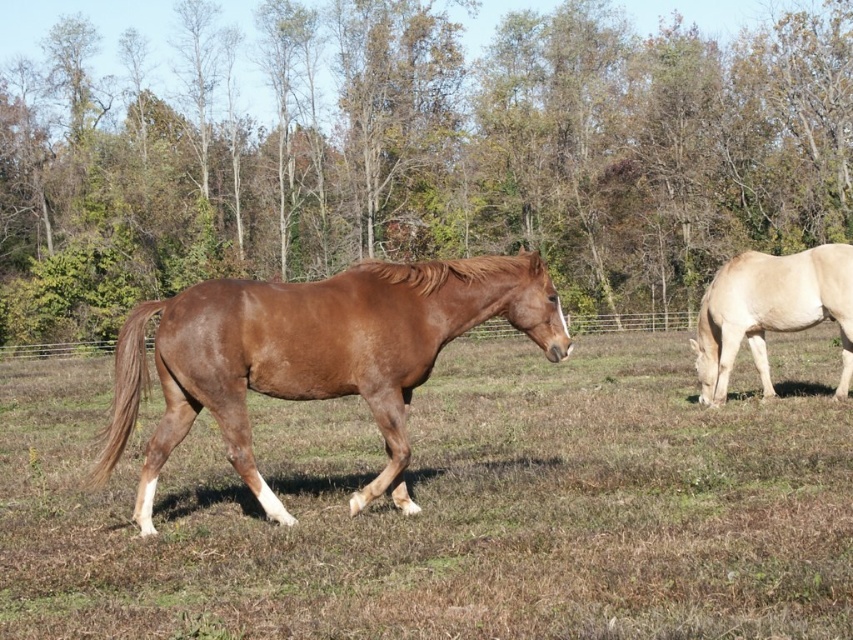
Question: Can you confirm if brown glossy horse at center is positioned to the right of light beige smooth horse at right?

Choices:
 (A) no
 (B) yes

Answer: (A)

Question: Is brown horse at center closer to camera compared to brown glossy horse at center?

Choices:
 (A) no
 (B) yes

Answer: (B)

Question: Which point is farther to the camera?

Choices:
 (A) (223, 426)
 (B) (850, 317)
 (C) (74, 198)

Answer: (C)

Question: Which object is farther from the camera taking this photo?

Choices:
 (A) light beige smooth horse at right
 (B) brown horse at center
 (C) green leafy tree at center
 (D) brown glossy horse at center

Answer: (C)

Question: Which point is farther from the camera taking this photo?

Choices:
 (A) pos(764,346)
 (B) pos(563,497)
 (C) pos(421,380)

Answer: (A)

Question: Does green leafy tree at center have a larger size compared to brown horse at center?

Choices:
 (A) yes
 (B) no

Answer: (A)